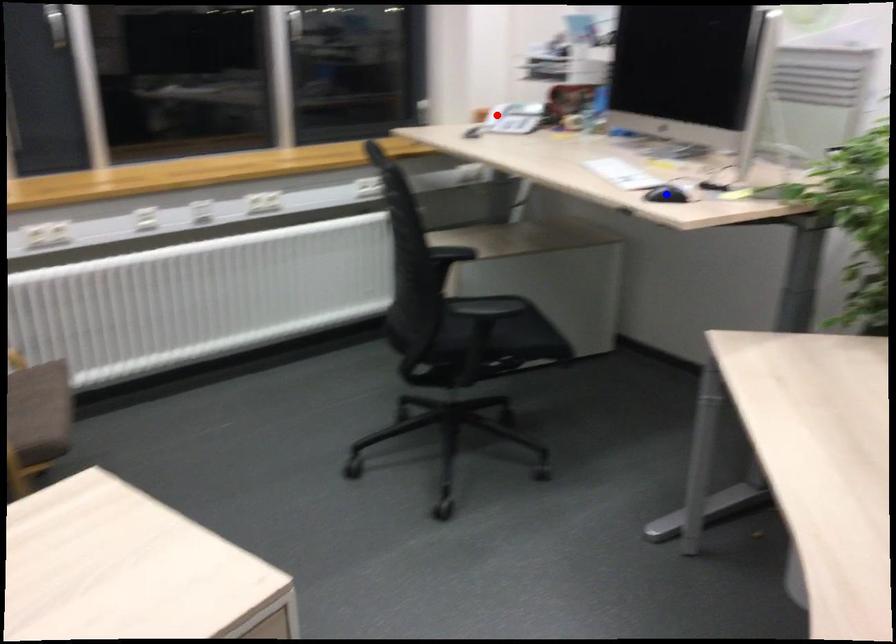
Question: In the image, two points are highlighted. Which point is nearer to the camera? Reply with the corresponding letter.

Choices:
 (A) blue point
 (B) red point

Answer: (A)